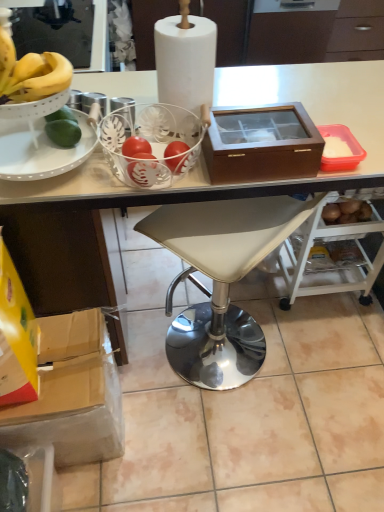
Measure the distance between point (290, 141) and camera.

A distance of 35.67 inches exists between point (290, 141) and camera.

What is the approximate width of cardboard box at lower left?

cardboard box at lower left is 42.26 centimeters wide.

Image resolution: width=384 pixels, height=512 pixels. Describe the element at coordinates (220, 281) in the screenshot. I see `white leather stool at center` at that location.

Describe the element at coordinates (176, 184) in the screenshot. I see `white leather stool at center` at that location.

You are a GUI agent. You are given a task and a screenshot of the screen. Output one action in this format:
    pyautogui.click(x=<x>, y=<y>)
    Task: Click on the white leather stool at center
    This screenshot has height=512, width=384.
    Given the screenshot: What is the action you would take?
    pyautogui.click(x=176, y=184)

At what (x,y) coordinates should I click in order to perform the action: click on white paper at center. Please return your answer as a coordinate pair (x, y). The image size is (384, 512). Looking at the image, I should click on (186, 61).

I want to click on brown wood box at upper right, so click(262, 144).

Can you confirm if white paper at center is thinner than white leather stool at center?

Yes, white paper at center is thinner than white leather stool at center.

Looking at this image, between white paper at center and white leather stool at center, which one appears on the right side from the viewer's perspective?

Positioned to the right is white leather stool at center.

I want to click on box that is above the cardboard box at lower left (from a real-world perspective), so click(262, 144).

Would you say cardboard box at lower left is to the left or to the right of brown wood box at upper right in the picture?

cardboard box at lower left is positioned on brown wood box at upper right's left side.

How different are the orientations of cardboard box at lower left and brown wood box at upper right in degrees?

The angular difference between cardboard box at lower left and brown wood box at upper right is 1.37 degrees.

Considering the sizes of objects cardboard box at lower left and brown wood box at upper right in the image provided, who is smaller, cardboard box at lower left or brown wood box at upper right?

brown wood box at upper right.

Considering the positions of objects cardboard box at lower left and white paper at center in the image provided, who is in front, cardboard box at lower left or white paper at center?

white paper at center is more forward.

Can we say cardboard box at lower left lies outside white paper at center?

cardboard box at lower left is positioned outside white paper at center.

Considering the relative positions of cardboard box at lower left and white paper at center in the image provided, is cardboard box at lower left to the right of white paper at center from the viewer's perspective?

No, cardboard box at lower left is not to the right of white paper at center.

Looking at this image, is cardboard box at lower left oriented away from white paper at center?

No, white paper at center is not at the back of cardboard box at lower left.

Which is closer, (229, 330) or (164, 29)?

Clearly, point (229, 330) is more distant from the camera than point (164, 29).

From the image's perspective, who appears lower, white leather stool at center or white paper at center?

From the image's view, white leather stool at center is below.

Between white leather stool at center and white paper at center, which one is positioned behind?

white leather stool at center.

Between brown wood box at upper right and white leather stool at center, which one has larger width?

white leather stool at center is wider.

Measure the distance from brown wood box at upper right to white leather stool at center.

brown wood box at upper right and white leather stool at center are 24.52 inches apart.

Is brown wood box at upper right positioned beyond the bounds of white leather stool at center?

Indeed, brown wood box at upper right is completely outside white leather stool at center.

Between brown wood box at upper right and white leather stool at center, which one has larger size?

Bigger between the two is white leather stool at center.

In the scene shown: Could you tell me if brown wood box at upper right is facing white paper at center?

No, brown wood box at upper right is not turned towards white paper at center.

Between brown wood box at upper right and white paper at center, which one has larger width?

With larger width is brown wood box at upper right.

Which of these two, brown wood box at upper right or white paper at center, is bigger?

white paper at center.

From the image's perspective, who appears lower, brown wood box at upper right or white paper at center?

brown wood box at upper right is shown below in the image.

From a real-world perspective, relative to white leather stool at center, is white leather stool at center vertically above or below?

white leather stool at center is above white leather stool at center.

Does white leather stool at center have a smaller size compared to white leather stool at center?

No.

Looking at this image, is white leather stool at center taller than white leather stool at center?

Yes.

Is white leather stool at center inside white leather stool at center?

Yes, white leather stool at center can be found within white leather stool at center.

This screenshot has width=384, height=512. I want to click on chair located on the right of white paper at center, so click(220, 281).

At what (x,y) coordinates should I click in order to perform the action: click on box above the cardboard box at lower left (from the image's perspective). Please return your answer as a coordinate pair (x, y). This screenshot has height=512, width=384. Looking at the image, I should click on (262, 144).

Looking at the image, which one is located further to white leather stool at center, white leather stool at center or cardboard box at lower left?

white leather stool at center is positioned further to the anchor white leather stool at center.

Which object lies further to the anchor point white leather stool at center, white paper at center or cardboard box at lower left?

Based on the image, white paper at center appears to be further to white leather stool at center.

Consider the image. Looking at the image, which one is located further to brown wood box at upper right, cardboard box at lower left or white leather stool at center?

cardboard box at lower left.

Consider the image. Estimate the real-world distances between objects in this image. Which object is closer to cardboard box at lower left, white leather stool at center or white leather stool at center?

white leather stool at center is positioned closer to the anchor cardboard box at lower left.

Considering their positions, is white leather stool at center positioned closer to white paper at center than cardboard box at lower left?

white leather stool at center.

Considering their positions, is brown wood box at upper right positioned closer to white leather stool at center than white paper at center?

brown wood box at upper right lies closer to white leather stool at center than the other object.

When comparing their distances from white leather stool at center, does white paper at center or cardboard box at lower left seem further?

Based on the image, cardboard box at lower left appears to be further to white leather stool at center.

Estimate the real-world distances between objects in this image. Which object is further from white leather stool at center, cardboard box at lower left or white leather stool at center?

white leather stool at center is further to white leather stool at center.

Locate an element on the screen. The width and height of the screenshot is (384, 512). box between white leather stool at center and cardboard box at lower left vertically is located at coordinates click(x=262, y=144).

You are a GUI agent. You are given a task and a screenshot of the screen. Output one action in this format:
    pyautogui.click(x=<x>, y=<y>)
    Task: Click on the chair that lies between white paper at center and cardboard box at lower left from top to bottom
    Image resolution: width=384 pixels, height=512 pixels.
    Given the screenshot: What is the action you would take?
    pyautogui.click(x=220, y=281)

Identify the location of box between white leather stool at center and white leather stool at center vertically. The image size is (384, 512). (262, 144).

Find the location of a particular element. This screenshot has width=384, height=512. box between white paper at center and white leather stool at center vertically is located at coordinates (262, 144).